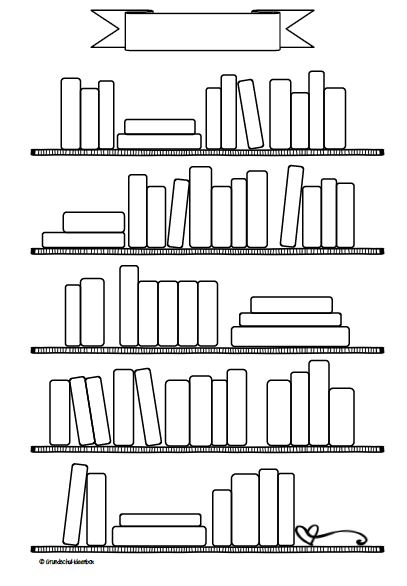
In order to click on books on the middle shelf in this screenshot , I will do `click(74, 316)`, `click(91, 316)`, `click(129, 306)`, `click(144, 310)`, `click(167, 311)`, `click(186, 314)`, `click(211, 315)`, `click(271, 306)`, `click(270, 319)`, `click(269, 332)`.